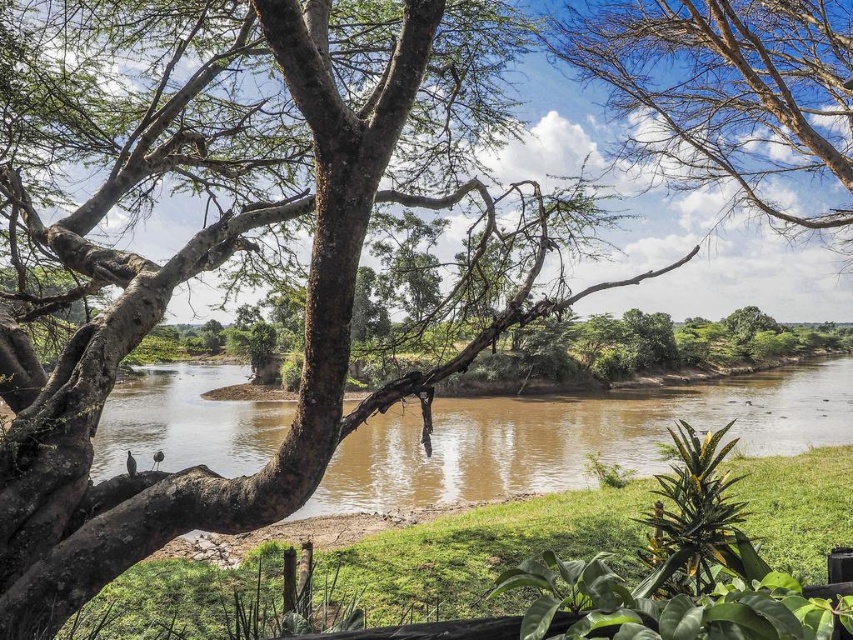
Which is above, brown muddy water at center or bare branches at upper center?

bare branches at upper center is above.

Does brown muddy water at center have a greater height compared to bare branches at upper center?

In fact, brown muddy water at center may be shorter than bare branches at upper center.

The image size is (853, 640). What do you see at coordinates (573, 436) in the screenshot?
I see `brown muddy water at center` at bounding box center [573, 436].

The image size is (853, 640). I want to click on brown muddy water at center, so click(573, 436).